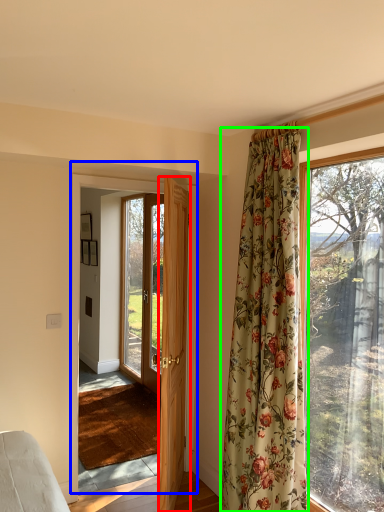
Question: Which object is the farthest from door (highlighted by a red box)? Choose among these: door (highlighted by a blue box) or curtain (highlighted by a green box).

Choices:
 (A) door
 (B) curtain

Answer: (A)